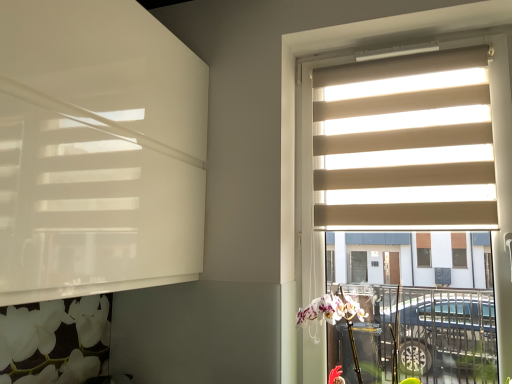
Question: Is point (500, 132) positioned closer to the camera than point (385, 193)?

Choices:
 (A) farther
 (B) closer

Answer: (B)

Question: From the image's perspective, is beige fabric blinds at right located above or below beige fabric blinds at upper right?

Choices:
 (A) below
 (B) above

Answer: (A)

Question: Relative to beige fabric blinds at upper right, is beige fabric blinds at right in front or behind?

Choices:
 (A) behind
 (B) front

Answer: (B)

Question: From a real-world perspective, is beige fabric blinds at upper right above or below beige fabric blinds at right?

Choices:
 (A) above
 (B) below

Answer: (A)

Question: Looking at their shapes, would you say beige fabric blinds at upper right is wider or thinner than beige fabric blinds at right?

Choices:
 (A) thin
 (B) wide

Answer: (A)

Question: Is beige fabric blinds at upper right taller or shorter than beige fabric blinds at right?

Choices:
 (A) tall
 (B) short

Answer: (B)

Question: From the image's perspective, relative to beige fabric blinds at right, is beige fabric blinds at upper right above or below?

Choices:
 (A) above
 (B) below

Answer: (A)